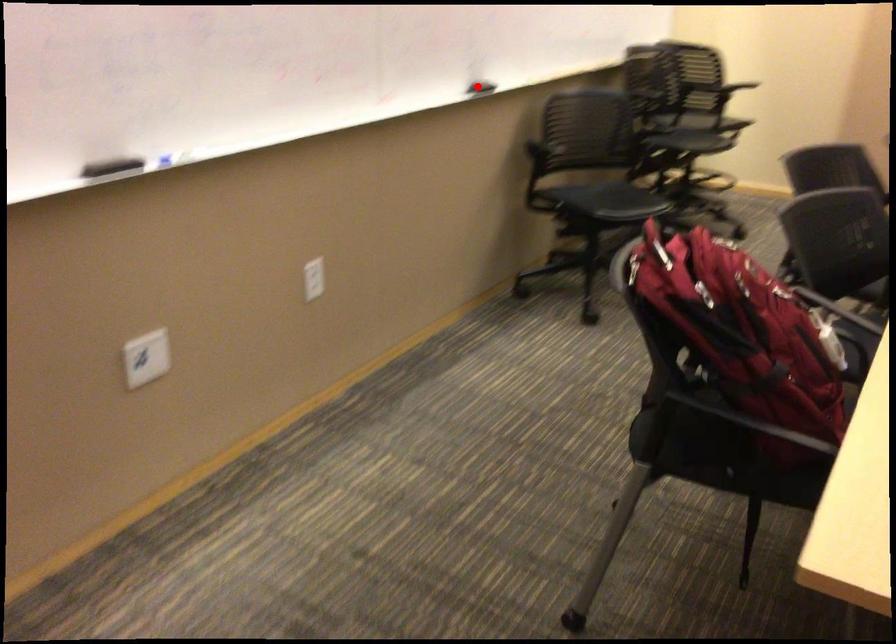
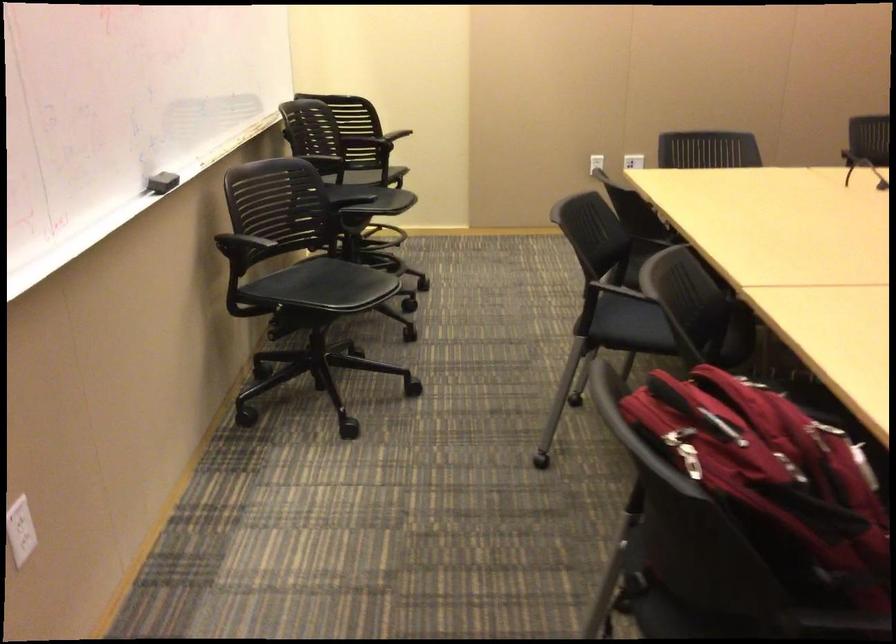
Locate, in the second image, the point that corresponds to the highlighted location in the first image.

(161, 182)